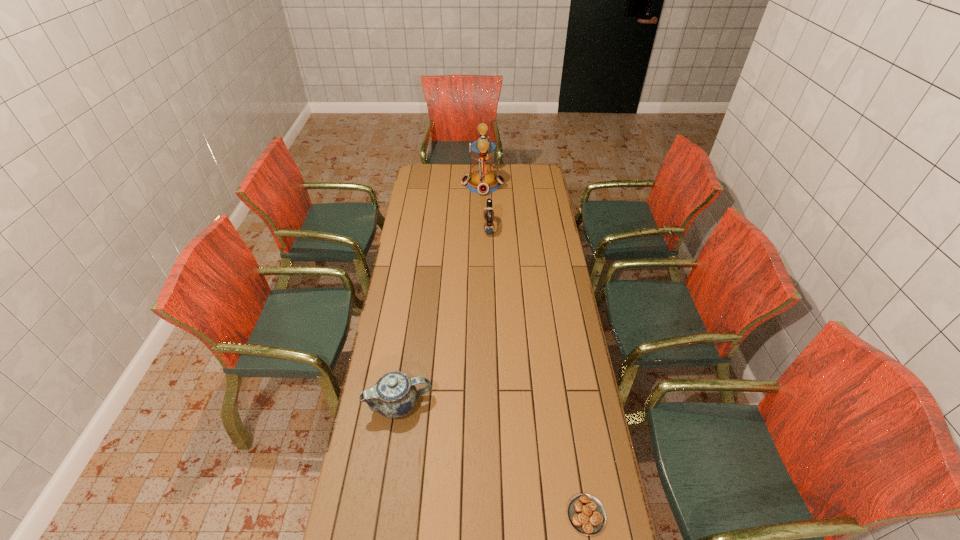
Find the location of `empty space between the second farthest object and the second nearest object`. empty space between the second farthest object and the second nearest object is located at coordinates (444, 316).

Identify the location of object that stands as the closest to the leftmost object. (586, 514).

Select which object is the second closest to the third nearest object. Please provide its 2D coordinates. Your answer should be formatted as a tuple, i.e. [(x, y)], where the tuple contains the x and y coordinates of a point satisfying the conditions above.

[(394, 395)]

Locate an element on the screen. free location that satisfies the following two spatial constraints: 1. on the back side of the rightmost object; 2. from the spout of the third farthest object is located at coordinates (568, 404).

This screenshot has width=960, height=540. I want to click on free spot that satisfies the following two spatial constraints: 1. from the spout of the pastry; 2. on the right side of the chinaware, so pos(383,515).

Identify the location of vacant area in the image that satisfies the following two spatial constraints: 1. on the back side of the nearest object; 2. on the front-facing side of the farthest object. coord(534,184).

In order to click on free location that satisfies the following two spatial constraints: 1. on the front-facing side of the lantern; 2. on the back side of the rightmost object in this screenshot , I will do `click(486, 515)`.

Where is `vacant space that satisfies the following two spatial constraints: 1. on the front-facing side of the nearest object; 2. on the left side of the lantern`? The width and height of the screenshot is (960, 540). vacant space that satisfies the following two spatial constraints: 1. on the front-facing side of the nearest object; 2. on the left side of the lantern is located at coordinates (486, 515).

This screenshot has height=540, width=960. In order to click on free space that satisfies the following two spatial constraints: 1. on the front-facing side of the lantern; 2. on the back side of the rightmost object in this screenshot , I will do `click(486, 515)`.

Identify the location of free space that satisfies the following two spatial constraints: 1. on the front-facing side of the lantern; 2. on the right side of the nearest object. The image size is (960, 540). (486, 515).